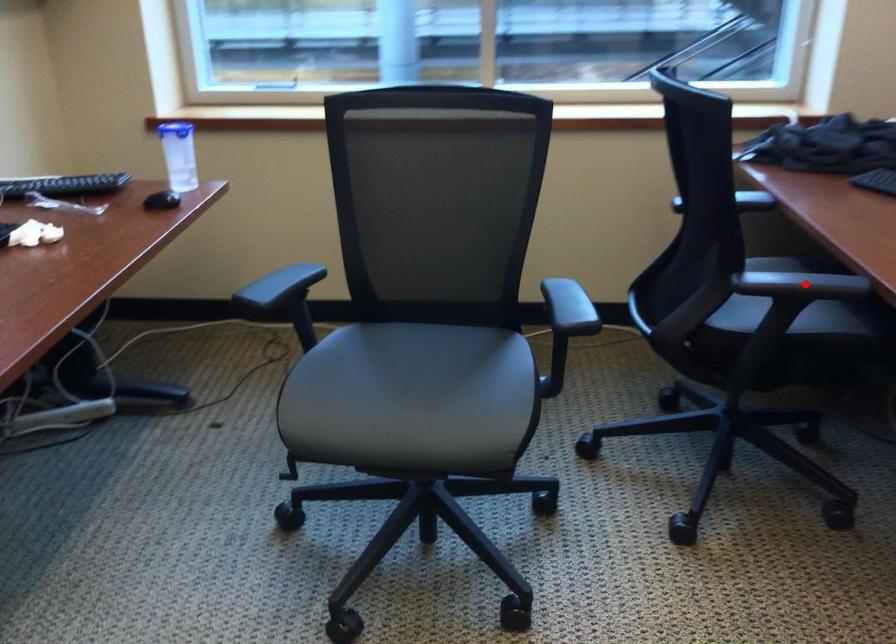
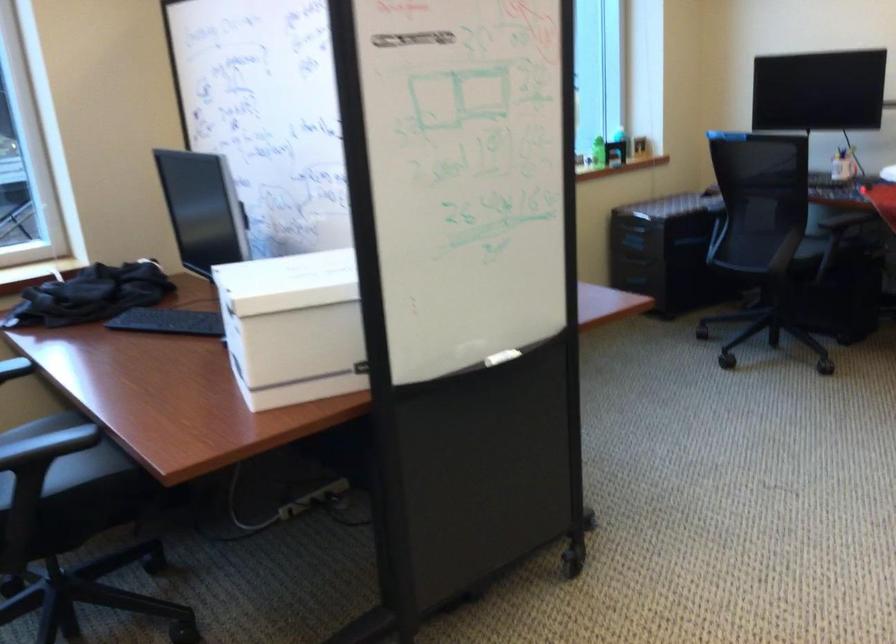
Where in the second image is the point corresponding to the highlighted location from the first image?

(47, 446)